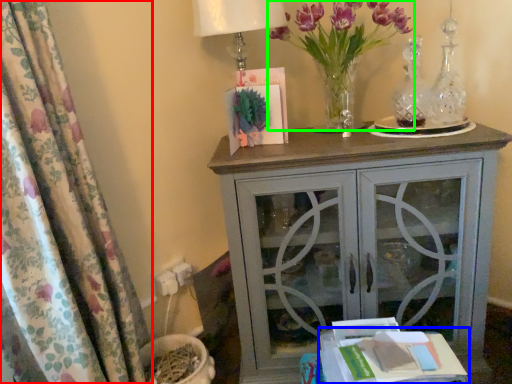
Question: Which is farther away from curtain (highlighted by a red box)? table (highlighted by a blue box) or floral arrangement (highlighted by a green box)?

Choices:
 (A) table
 (B) floral arrangement

Answer: (B)